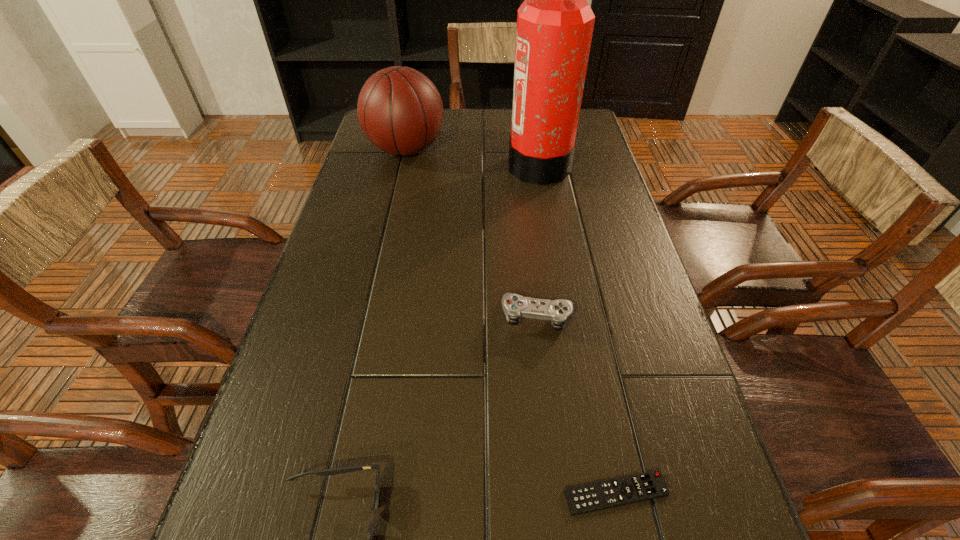
Image resolution: width=960 pixels, height=540 pixels. In order to click on vacant region at the right edge of the desktop in this screenshot , I will do `click(651, 349)`.

Locate an element on the screen. The image size is (960, 540). free space at the far left corner of the desktop is located at coordinates (363, 141).

Locate an element on the screen. The height and width of the screenshot is (540, 960). free region at the far right corner of the desktop is located at coordinates (585, 126).

The image size is (960, 540). Find the location of `free space between the basketball and the fire extinguisher`. free space between the basketball and the fire extinguisher is located at coordinates (472, 157).

Identify the location of blank region between the fire extinguisher and the remote control. The image size is (960, 540). (x=577, y=328).

This screenshot has height=540, width=960. Identify the location of blank region between the third shortest object and the remote control. (577, 405).

You are a GUI agent. You are given a task and a screenshot of the screen. Output one action in this format:
    pyautogui.click(x=<x>, y=<y>)
    Task: Click on the free space between the shortest object and the fire extinguisher
    This screenshot has width=960, height=540.
    Given the screenshot: What is the action you would take?
    pyautogui.click(x=577, y=328)

The image size is (960, 540). Find the location of `vacant region between the tallest object and the third nearest object`. vacant region between the tallest object and the third nearest object is located at coordinates (539, 240).

You are a GUI agent. You are given a task and a screenshot of the screen. Output one action in this format:
    pyautogui.click(x=<x>, y=<y>)
    Task: Click on the free spot between the fourth shortest object and the control
    The image size is (960, 540).
    Given the screenshot: What is the action you would take?
    pyautogui.click(x=472, y=233)

Where is `object that is the third closest to the shortest object`? object that is the third closest to the shortest object is located at coordinates (555, 23).